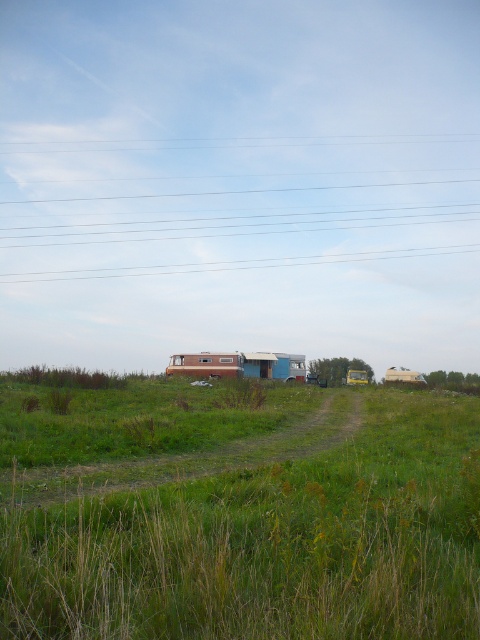
Question: Considering the real-world distances, which object is farthest from the wooden cabin at center?

Choices:
 (A) transparent wire at upper center
 (B) brown wood cabin at center

Answer: (A)

Question: Can you confirm if green grassy at center is positioned above brown wood cabin at center?

Choices:
 (A) yes
 (B) no

Answer: (A)

Question: Can you confirm if transparent wire at upper center is thinner than wooden cabin at center?

Choices:
 (A) yes
 (B) no

Answer: (B)

Question: Which object appears farthest from the camera in this image?

Choices:
 (A) wooden cabin at center
 (B) green grassy at center

Answer: (A)

Question: Which of the following is the closest to the observer?

Choices:
 (A) (178, 368)
 (B) (183, 577)
 (C) (356, 224)

Answer: (B)

Question: Is transparent wire at upper center in front of wooden cabin at center?

Choices:
 (A) yes
 (B) no

Answer: (B)